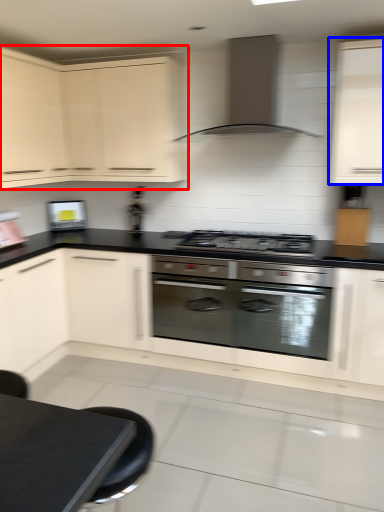
Question: Which object is further to the camera taking this photo, cabinetry (highlighted by a red box) or cabinetry (highlighted by a blue box)?

Choices:
 (A) cabinetry
 (B) cabinetry

Answer: (A)